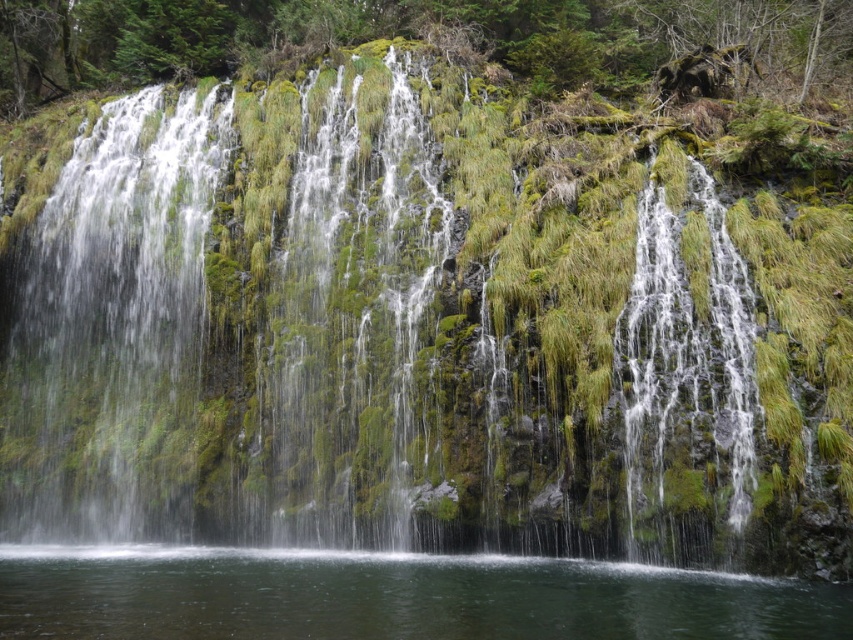
Question: Does green mossy rock at center have a larger size compared to clear water at center?

Choices:
 (A) yes
 (B) no

Answer: (A)

Question: Based on their relative distances, which object is farther from the clear water at center?

Choices:
 (A) green mossy rock at center
 (B) green mossy waterfall at right

Answer: (A)

Question: Is clear water at center above green mossy waterfall at right?

Choices:
 (A) yes
 (B) no

Answer: (B)

Question: Among these points, which one is farthest from the camera?

Choices:
 (A) (74, 563)
 (B) (297, 288)

Answer: (B)

Question: Is the position of green mossy rock at center more distant than that of green mossy waterfall at right?

Choices:
 (A) no
 (B) yes

Answer: (A)

Question: Which point is farther to the camera?

Choices:
 (A) (701, 547)
 (B) (508, 579)

Answer: (B)